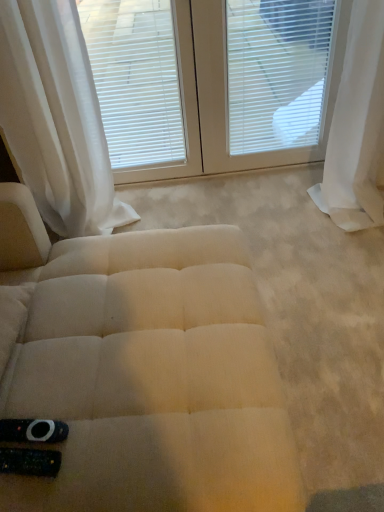
This screenshot has height=512, width=384. I want to click on vacant area that lies between white matte window blind at upper center and white sheer curtain at right, the first curtain viewed from the right, so click(x=249, y=200).